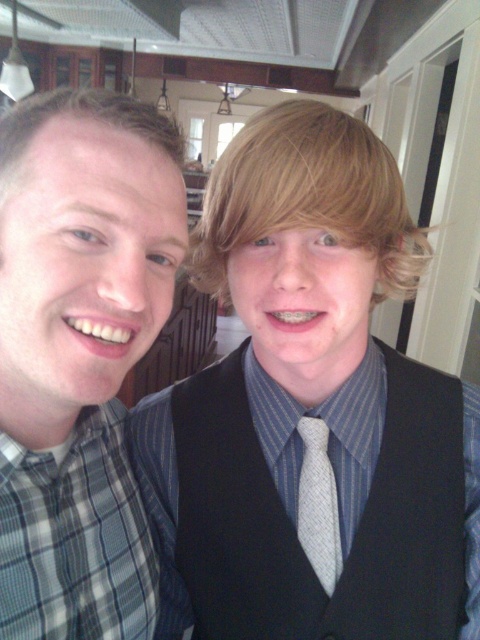
Does matte black vest at center lie in front of light gray textured tie at center?

Yes.

Who is positioned more to the left, matte black vest at center or light gray textured tie at center?

From the viewer's perspective, matte black vest at center appears more on the left side.

At what (x,y) coordinates should I click in order to perform the action: click on matte black vest at center. Please return your answer as a coordinate pair (x, y). Looking at the image, I should click on (311, 406).

Who is lower down, plaid shirt at left or light gray textured tie at center?

light gray textured tie at center is lower down.

Does plaid shirt at left have a lesser width compared to light gray textured tie at center?

No.

Find the location of `plaid shirt at left`. plaid shirt at left is located at coordinates (80, 355).

Identify the location of plaid shirt at left. (80, 355).

Find the location of a particular element. The width and height of the screenshot is (480, 640). matte black vest at center is located at coordinates [x=311, y=406].

Can you confirm if matte black vest at center is positioned to the right of plaid shirt at left?

Correct, you'll find matte black vest at center to the right of plaid shirt at left.

Which is in front, point (210, 433) or point (120, 252)?

Point (120, 252) is in front.

Locate an element on the screen. matte black vest at center is located at coordinates (311, 406).